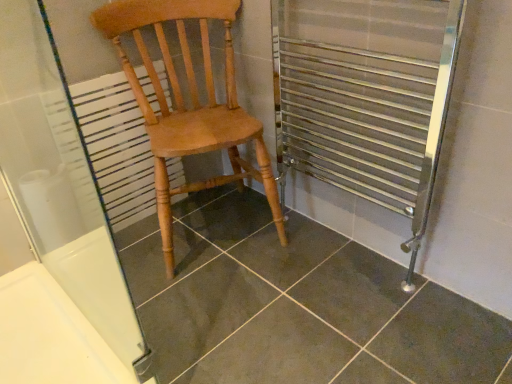
Where is `blank space situated above dark gray tile at center (from a real-world perspective)`? blank space situated above dark gray tile at center (from a real-world perspective) is located at coordinates (208, 313).